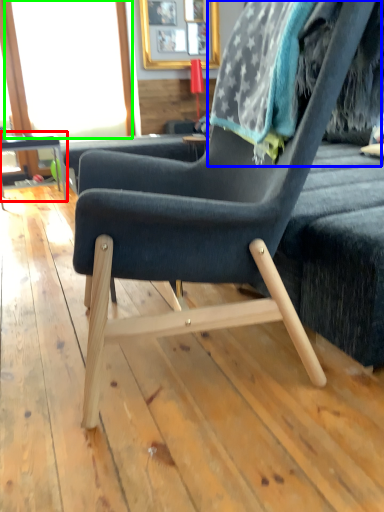
Question: Estimate the real-world distances between objects in this image. Which object is closer to table (highlighted by a red box), bean bag chair (highlighted by a blue box) or window screen (highlighted by a green box)?

Choices:
 (A) bean bag chair
 (B) window screen

Answer: (B)